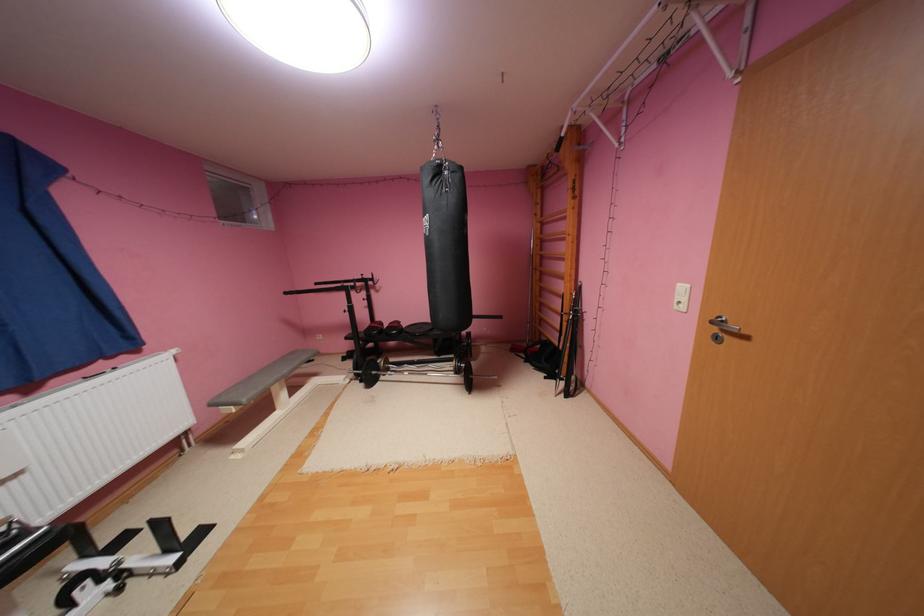
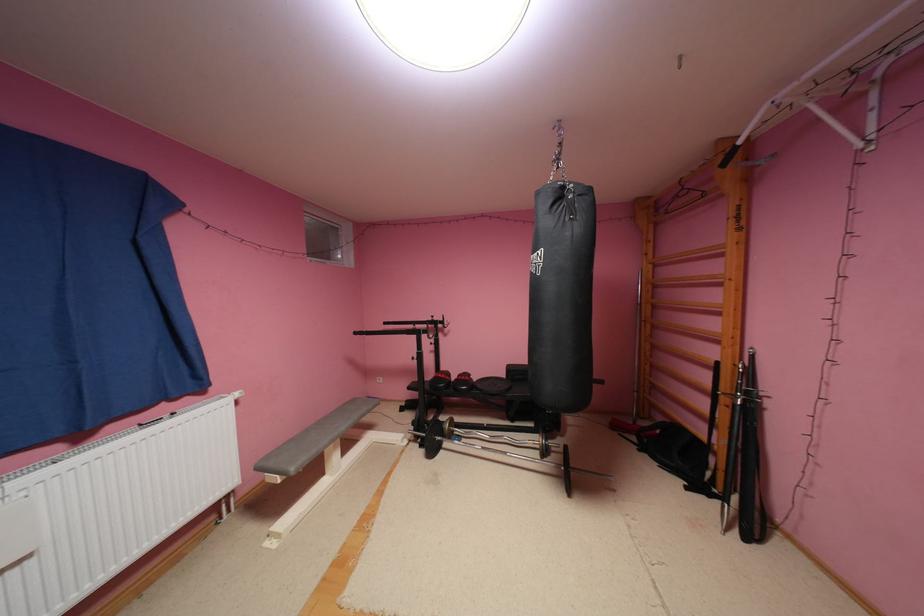
Question: The camera is either moving clockwise (left) or counter-clockwise (right) around the object. The first image is from the beginning of the video and the second image is from the end. Is the camera moving left or right when shooting the video?

Choices:
 (A) Left
 (B) Right

Answer: (B)